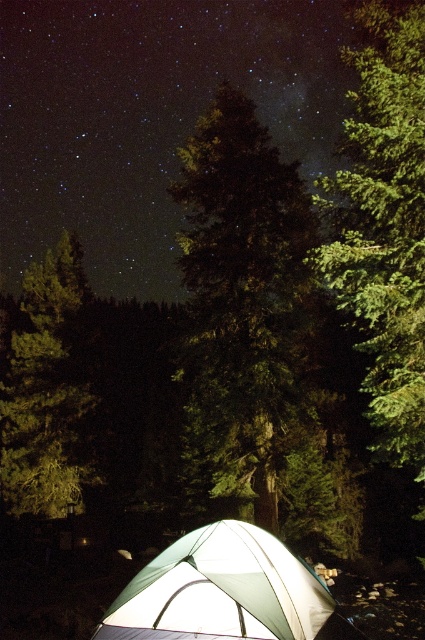
You are standing in front of the tent and want to walk towards the green textured tree at center and the green textured tree at left. Which tree will you reach first?

The green textured tree at center is closer to the viewer than the green textured tree at left, so you will reach the green textured tree at center first.

You are a hiker who just arrived at the campsite and want to set up a satellite dish to get a signal. The dish needs to be placed where it can have an unobstructed view of the sky. Given the white fabric tent at lower center and the green textured tree at left, which object should you place the satellite dish away from to avoid obstruction?

The white fabric tent at lower center has a lesser height compared to the green textured tree at left. Therefore, to avoid obstruction, the satellite dish should be placed away from the green textured tree at left since it is taller and could block the view.

You are standing in the forest and see two points of light in the sky. One is at point (x=249, y=381) and the other is at point (x=371, y=92). Which point is closer to you?

Point (x=371, y=92) is closer to you because it is in front of point (x=249, y=381).